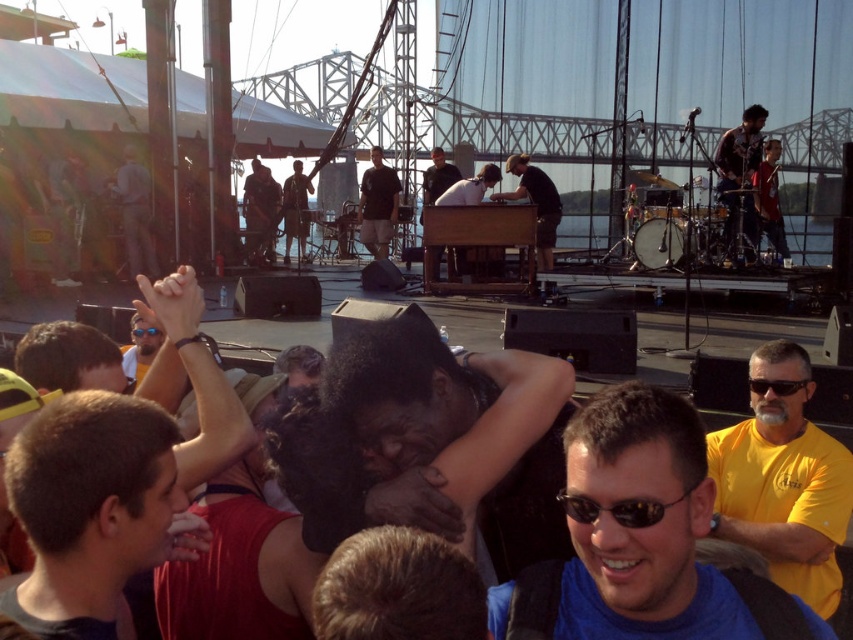
Question: Does matte black keyboard at center appear under blue plastic goggles at upper center?

Choices:
 (A) no
 (B) yes

Answer: (A)

Question: Does blue fabric shirt at center appear over brown hair at lower left?

Choices:
 (A) no
 (B) yes

Answer: (A)

Question: Which object is positioned closest to the black plastic sunglasses at lower right?

Choices:
 (A) blue fabric shirt at center
 (B) shiny black guitar at right

Answer: (A)

Question: Which point is closer to the camera?

Choices:
 (A) black plastic sunglasses at upper right
 (B) blue fabric shirt at center
 (C) dark brown shirt at center

Answer: (B)

Question: Can you confirm if matte black keyboard at center is wider than black plastic sunglasses at lower right?

Choices:
 (A) yes
 (B) no

Answer: (A)

Question: Among these objects, which one is nearest to the camera?

Choices:
 (A) matte black keyboard at center
 (B) brown hair at lower left
 (C) yellow t-shirt at right
 (D) black plastic sunglasses at upper right

Answer: (B)